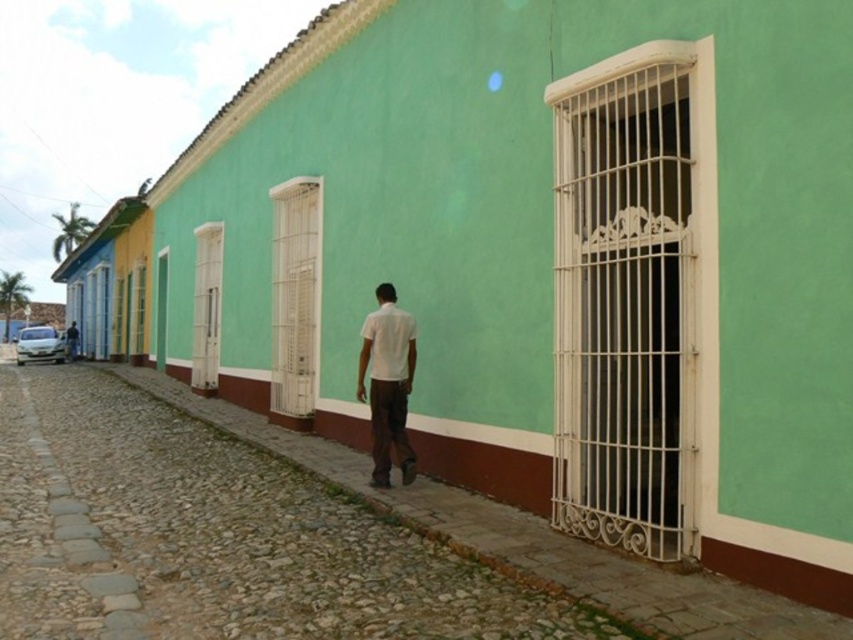
Who is lower down, white matte shirt at center or white glossy car at left?

Positioned lower is white glossy car at left.

Does white matte shirt at center appear over white glossy car at left?

Indeed, white matte shirt at center is positioned over white glossy car at left.

This screenshot has height=640, width=853. What do you see at coordinates (387, 384) in the screenshot?
I see `white matte shirt at center` at bounding box center [387, 384].

This screenshot has height=640, width=853. In order to click on white matte shirt at center in this screenshot , I will do `click(387, 384)`.